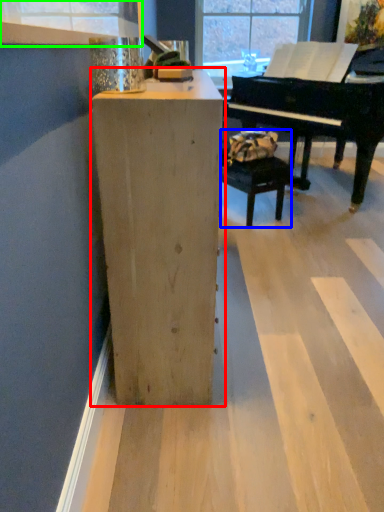
Question: Considering the real-world distances, which object is closest to furniture (highlighted by a red box)? armchair (highlighted by a blue box) or window frame (highlighted by a green box).

Choices:
 (A) armchair
 (B) window frame

Answer: (B)